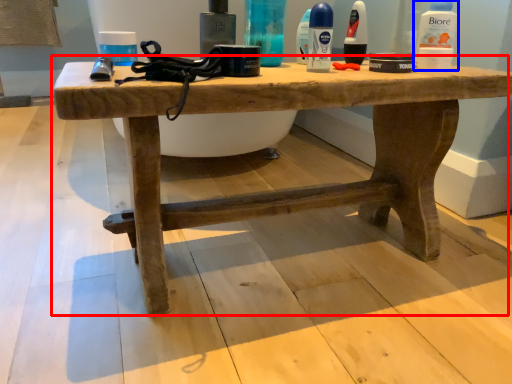
Question: Which object appears farthest to the camera in this image, table (highlighted by a red box) or mouthwash (highlighted by a blue box)?

Choices:
 (A) table
 (B) mouthwash

Answer: (B)